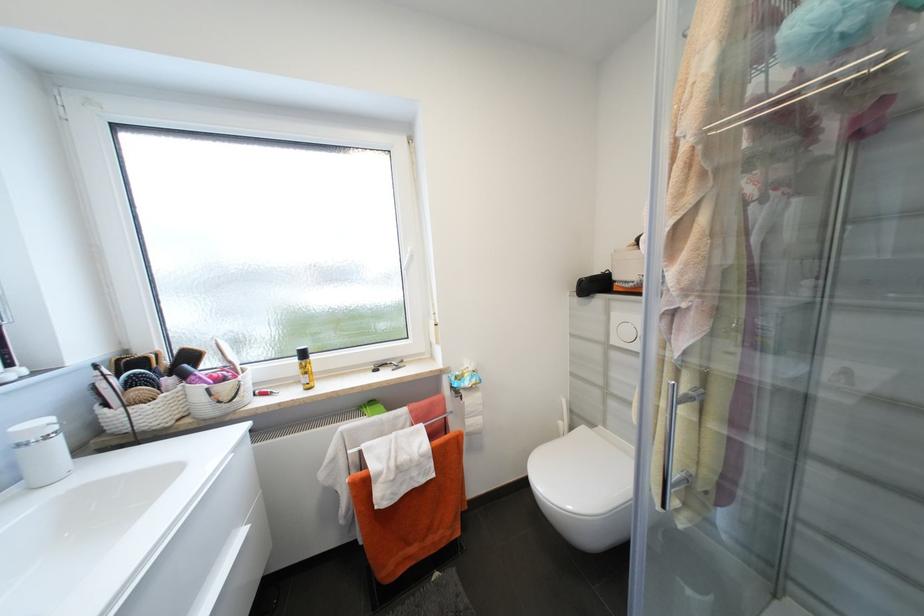
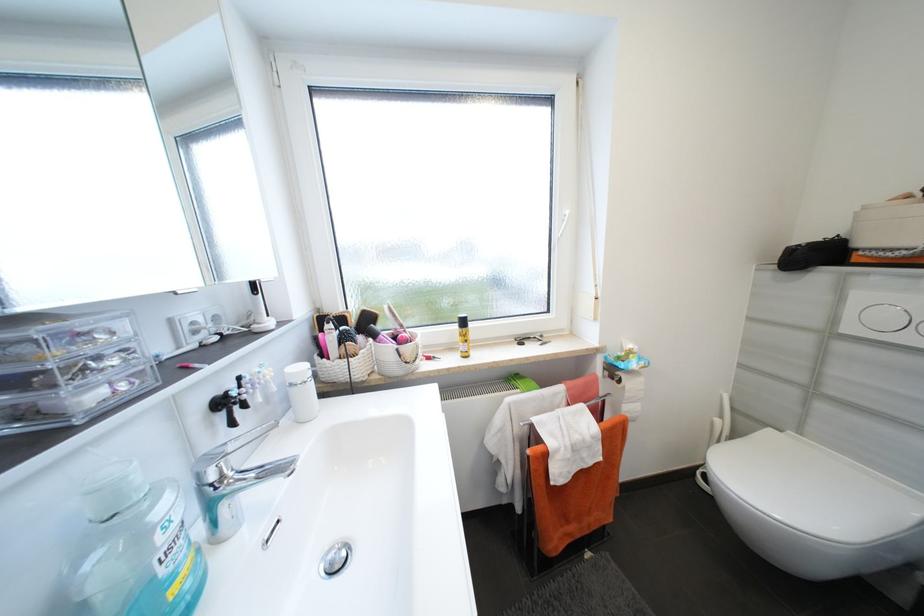
Question: The images are taken continuously from a first-person perspective. In which direction are you moving?

Choices:
 (A) Left
 (B) Right
 (C) Forward
 (D) Backward

Answer: (A)